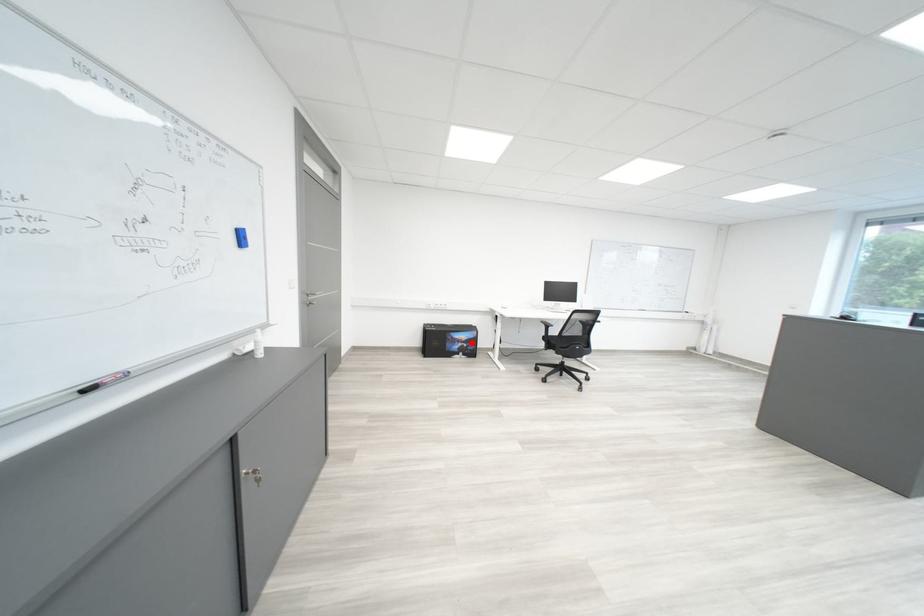
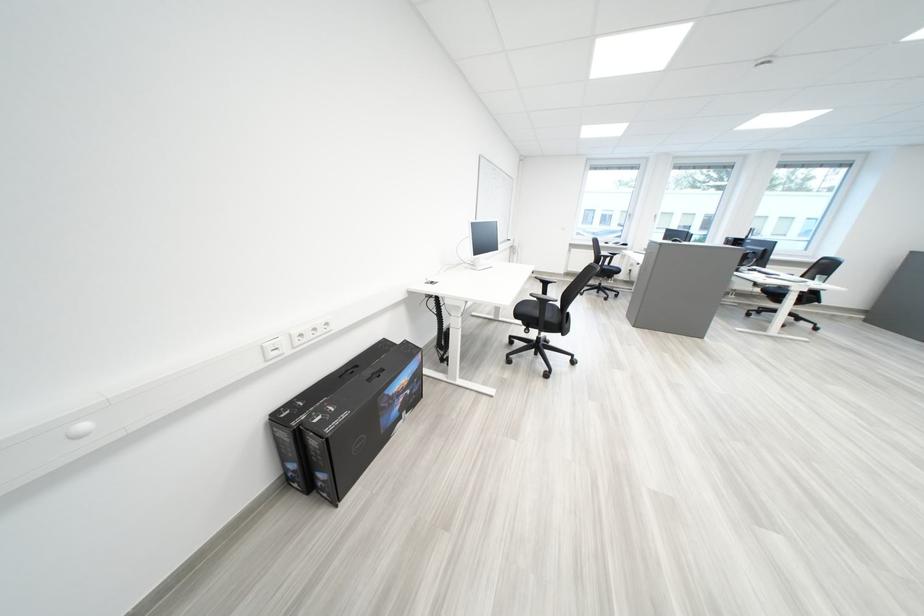
Question: I am providing you with two images of the same scene from different viewpoints. A red point is shown in image1. For the corresponding object point in image2, is it positioned nearer or farther from the camera?

Choices:
 (A) Nearer
 (B) Farther

Answer: (A)